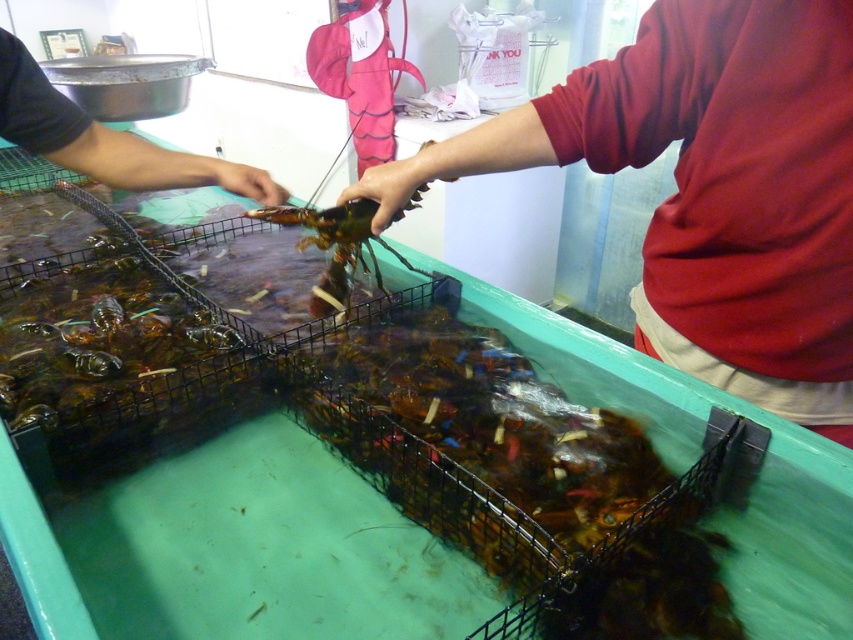
Can you confirm if matte red shirt at center is taller than black matte hand at upper left?

Correct, matte red shirt at center is much taller as black matte hand at upper left.

Which is behind, point (671, 22) or point (22, 61)?

Point (22, 61)

The width and height of the screenshot is (853, 640). I want to click on matte red shirt at center, so click(711, 189).